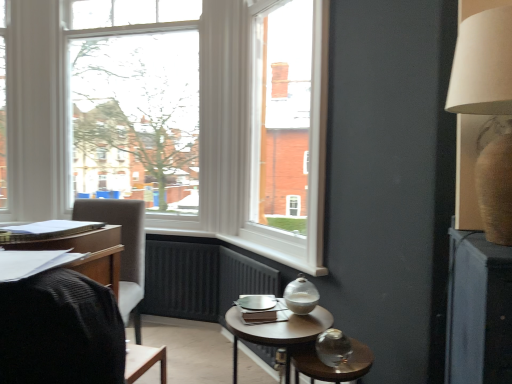
Question: Are matte black desk at left and beige fabric lampshade at upper right making contact?

Choices:
 (A) yes
 (B) no

Answer: (B)

Question: Is matte black desk at left bigger than beige fabric lampshade at upper right?

Choices:
 (A) no
 (B) yes

Answer: (A)

Question: Could beige fabric lampshade at upper right be considered to be inside matte black desk at left?

Choices:
 (A) yes
 (B) no

Answer: (B)

Question: Is the depth of matte black desk at left less than that of beige fabric lampshade at upper right?

Choices:
 (A) no
 (B) yes

Answer: (B)

Question: Considering the relative sizes of matte black desk at left and beige fabric lampshade at upper right in the image provided, is matte black desk at left thinner than beige fabric lampshade at upper right?

Choices:
 (A) yes
 (B) no

Answer: (B)

Question: In terms of size, does matte black desk at left appear bigger or smaller than wooden round table at center?

Choices:
 (A) small
 (B) big

Answer: (A)

Question: Considering the positions of matte black desk at left and wooden round table at center in the image, is matte black desk at left wider or thinner than wooden round table at center?

Choices:
 (A) wide
 (B) thin

Answer: (B)

Question: Is point (118, 249) positioned closer to the camera than point (303, 332)?

Choices:
 (A) closer
 (B) farther

Answer: (B)

Question: From their relative heights in the image, would you say matte black desk at left is taller or shorter than wooden round table at center?

Choices:
 (A) tall
 (B) short

Answer: (B)

Question: Visually, is transparent glass table at lower right positioned to the left or to the right of wooden round table at center?

Choices:
 (A) right
 (B) left

Answer: (A)

Question: Is transparent glass table at lower right in front of or behind wooden round table at center in the image?

Choices:
 (A) behind
 (B) front

Answer: (B)

Question: In terms of size, does transparent glass table at lower right appear bigger or smaller than wooden round table at center?

Choices:
 (A) small
 (B) big

Answer: (A)

Question: From the image's perspective, relative to wooden round table at center, is transparent glass table at lower right above or below?

Choices:
 (A) below
 (B) above

Answer: (A)

Question: Considering the positions of beige fabric lampshade at upper right and wooden round table at center in the image, is beige fabric lampshade at upper right taller or shorter than wooden round table at center?

Choices:
 (A) tall
 (B) short

Answer: (A)

Question: From a real-world perspective, is beige fabric lampshade at upper right positioned above or below wooden round table at center?

Choices:
 (A) below
 (B) above

Answer: (B)